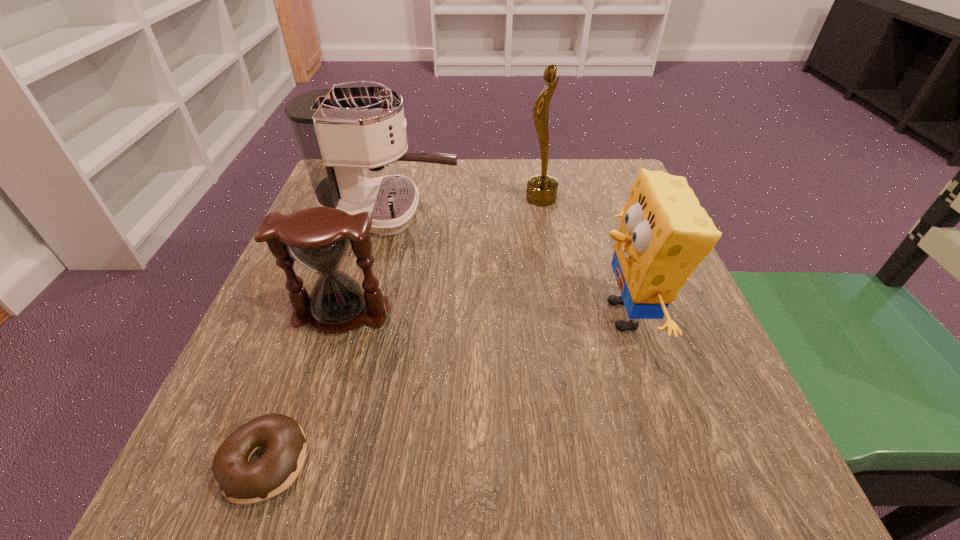
At what (x,y) coordinates should I click in order to perform the action: click on vacant region located 0.240m on the face of the sponge. Please return your answer as a coordinate pair (x, y). Looking at the image, I should click on (452, 315).

This screenshot has width=960, height=540. In order to click on vacant space located on the face of the sponge in this screenshot , I will do `click(504, 315)`.

Identify the location of vacant space located 0.050m on the face of the sponge. (562, 315).

Where is `vacant area situated on the front of the hourglass`? vacant area situated on the front of the hourglass is located at coordinates (319, 388).

I want to click on vacant position located 0.350m on the back of the nearest object, so click(x=338, y=260).

Locate an element on the screen. This screenshot has height=540, width=960. award located at the far edge is located at coordinates (542, 189).

The width and height of the screenshot is (960, 540). I want to click on coffee maker located in the far edge section of the desktop, so click(339, 131).

Where is `object located at the near edge`? This screenshot has height=540, width=960. object located at the near edge is located at coordinates pos(241,482).

Identify the location of coffee maker located in the left edge section of the desktop. (339, 131).

Image resolution: width=960 pixels, height=540 pixels. I want to click on hourglass situated at the left edge, so click(x=318, y=238).